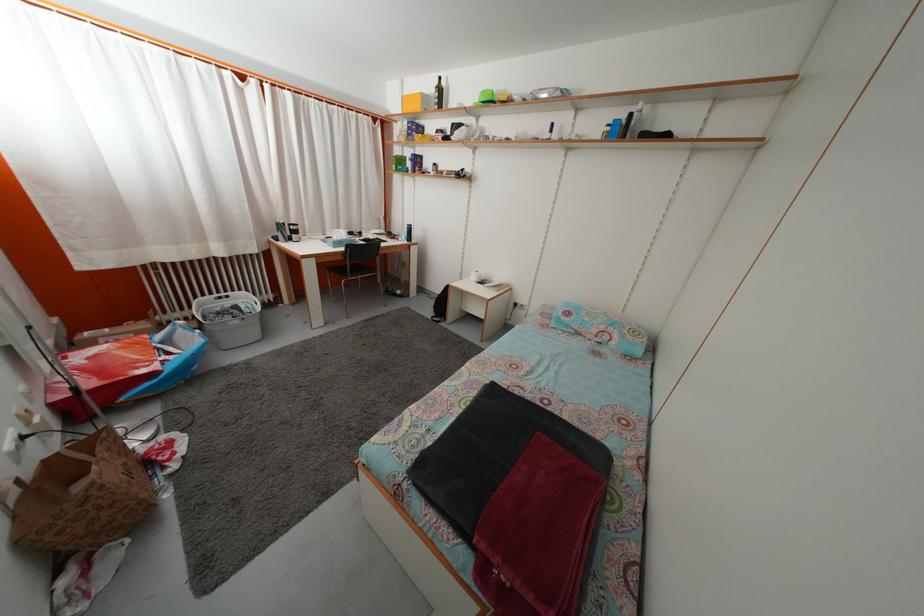
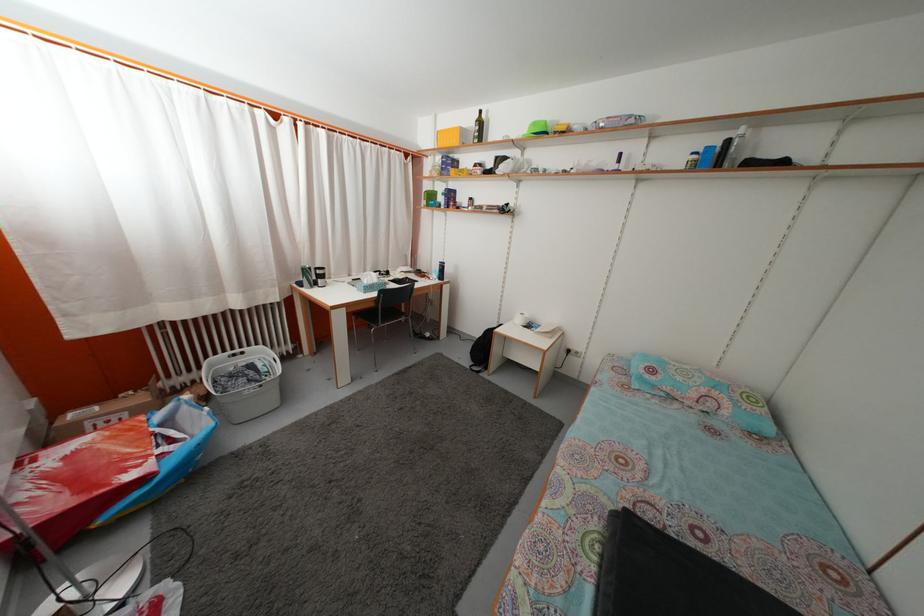
Where in the second image is the point corresponding to point 330,241 from the first image?

(355, 283)